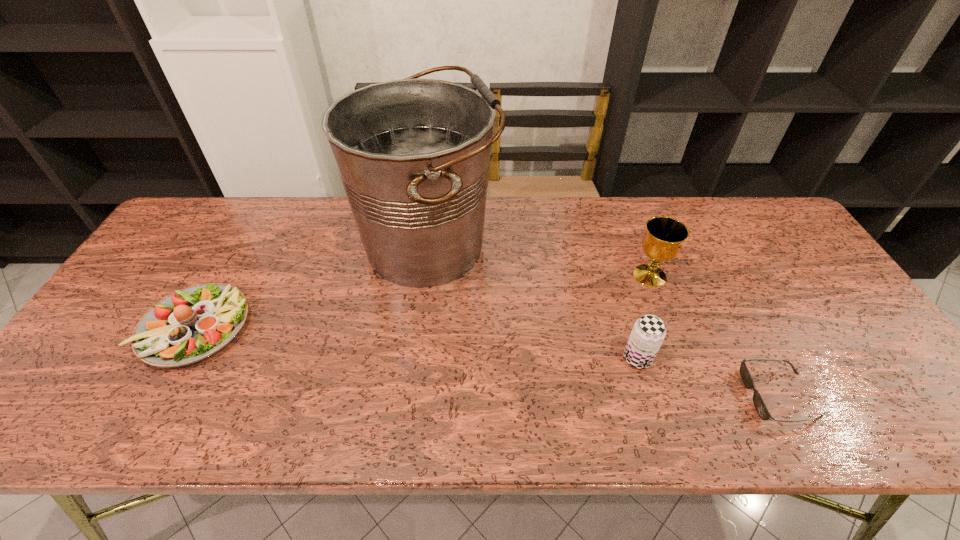
The image size is (960, 540). What are the coordinates of `bucket` in the screenshot? It's located at (413, 155).

The width and height of the screenshot is (960, 540). I want to click on the second object from left to right, so click(x=413, y=155).

You are a GUI agent. You are given a task and a screenshot of the screen. Output one action in this format:
    pyautogui.click(x=<x>, y=<y>)
    Task: Click on the chalice
    
    Given the screenshot: What is the action you would take?
    pyautogui.click(x=662, y=242)

Identify the location of the second object from right to left. The width and height of the screenshot is (960, 540). (662, 242).

Locate an element on the screen. The width and height of the screenshot is (960, 540). beer can is located at coordinates (648, 333).

The width and height of the screenshot is (960, 540). Identify the location of the third object from left to right. (648, 333).

Identify the location of the leftmost object. (191, 324).

This screenshot has height=540, width=960. What are the coordinates of `salad plate` in the screenshot? It's located at (191, 324).

Image resolution: width=960 pixels, height=540 pixels. I want to click on the rightmost object, so click(759, 404).

What are the coordinates of `the shortest object` in the screenshot? It's located at (759, 404).